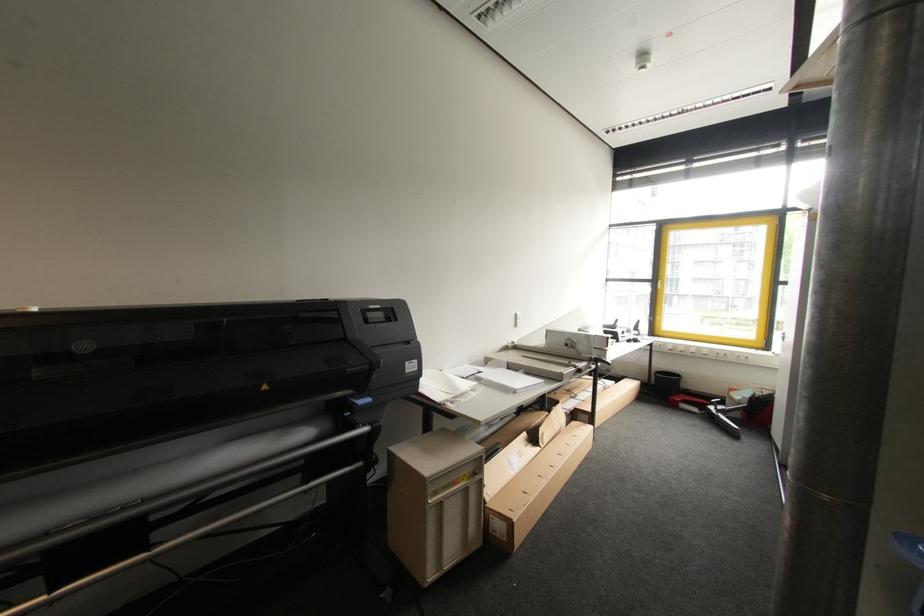
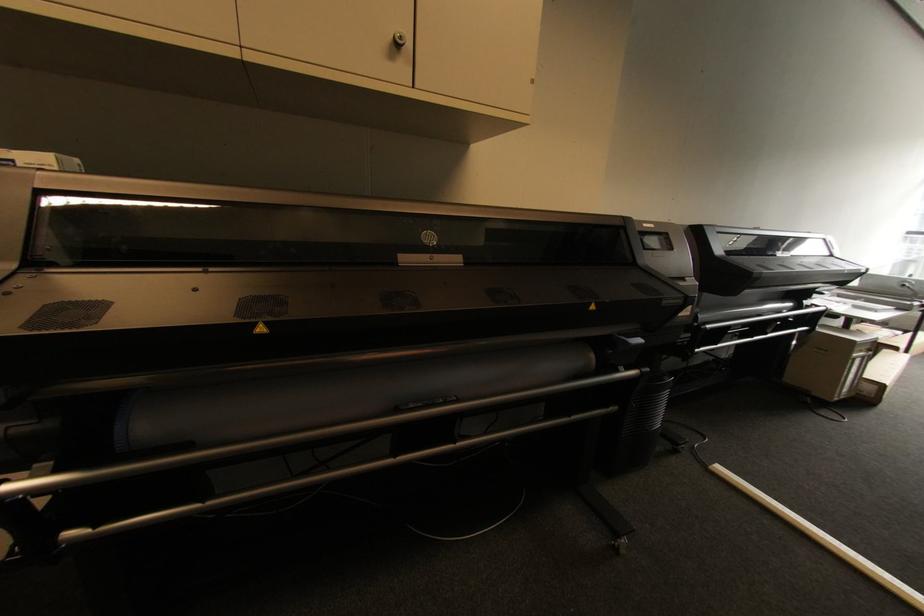
In the second image, find the point that corresponds to (458,484) in the first image.

(867, 352)